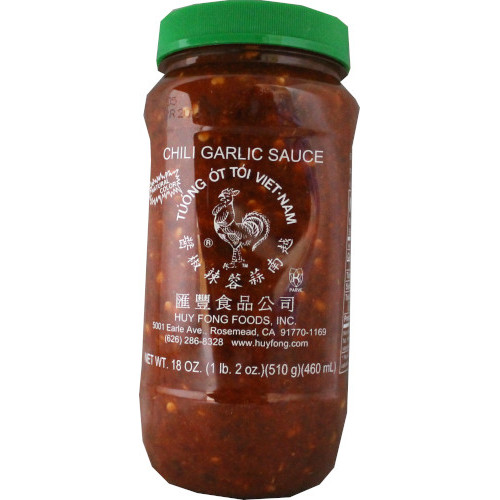
In order to click on bottle of sauce in this screenshot , I will do `click(266, 428)`.